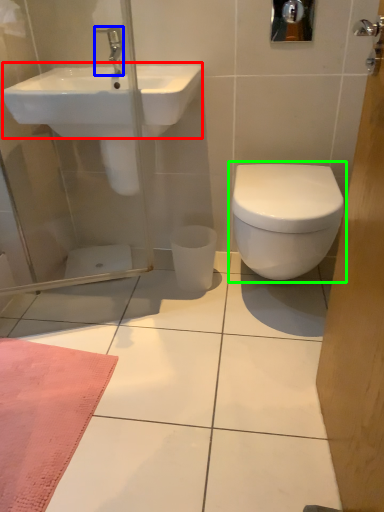
Question: Which object is the farthest from sink (highlighted by a red box)? Choose among these: tap (highlighted by a blue box) or toilet (highlighted by a green box).

Choices:
 (A) tap
 (B) toilet

Answer: (B)